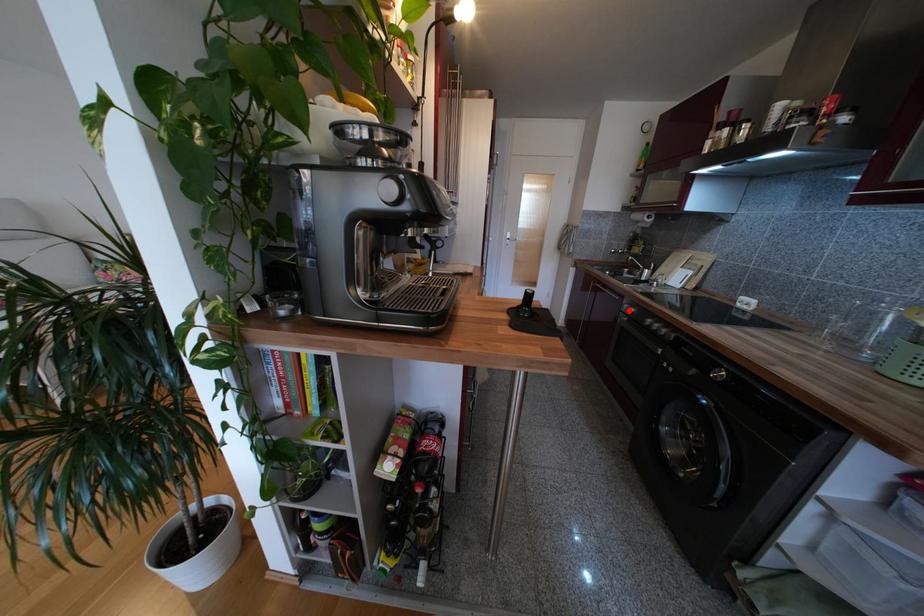
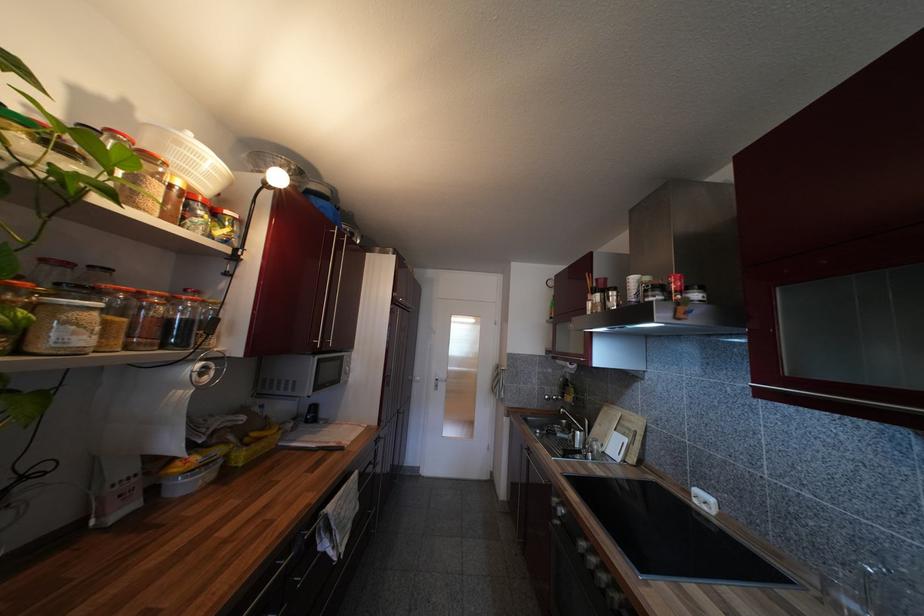
Question: I am providing you with two images of the same scene from different viewpoints. In image1, a red point is highlighted. Considering the same 3D point in image2, which of the following is correct?

Choices:
 (A) It is closer
 (B) It is farther

Answer: (B)